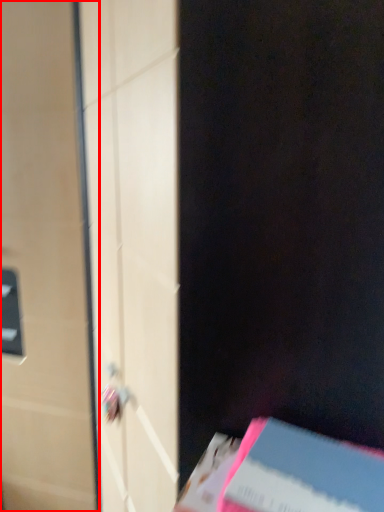
Question: From the image's perspective, considering the relative positions of door (annotated by the red box) and paperback book in the image provided, where is door (annotated by the red box) located with respect to the staircase?

Choices:
 (A) below
 (B) above

Answer: (B)